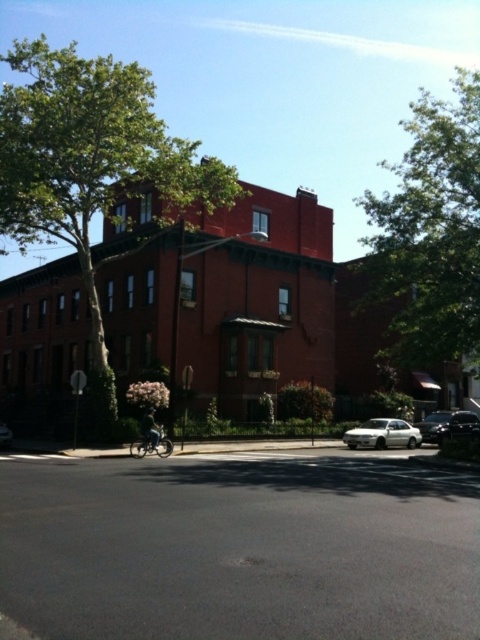
You are standing at the entrance of the large, red brick building and want to check if the shiny black sedan at lower right is within a 30 meter safety zone. Can you confirm if it is within the zone?

The shiny black sedan at lower right is 26.03 meters away from the viewer, which is within the 30 meter safety zone.

You are standing at the point labeled point (450,426). What object is located at that point?

The shiny black sedan at lower right is located at point (450,426).